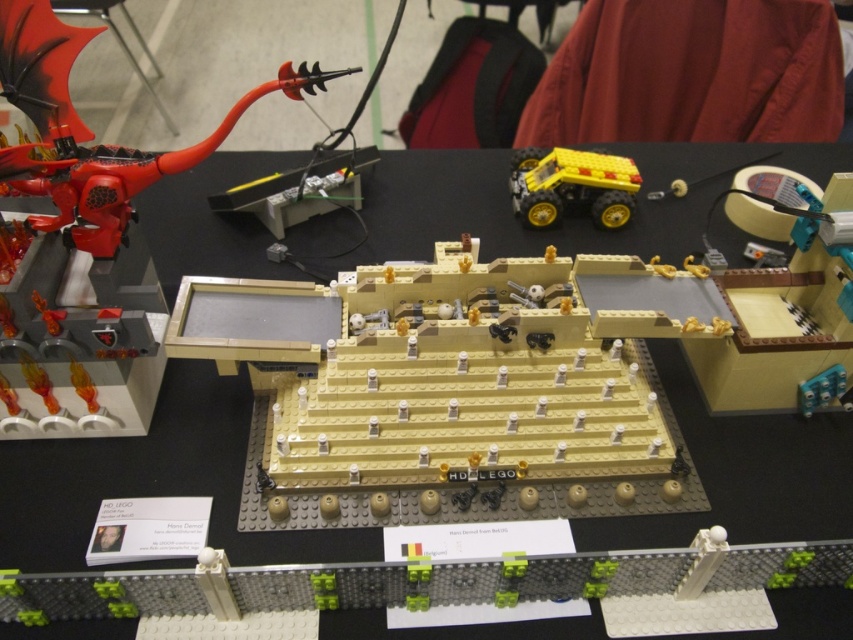
Which is in front, point (473, 582) or point (93, 148)?

Point (473, 582) is in front.

Does point (851, 579) come closer to viewer compared to point (39, 220)?

Yes, point (851, 579) is closer to viewer.

Where is `smooth gray wall at lower center`? The image size is (853, 640). smooth gray wall at lower center is located at coordinates (459, 580).

Does beige matte chessboard at center have a smaller size compared to smooth gray wall at lower center?

Actually, beige matte chessboard at center might be larger than smooth gray wall at lower center.

Is beige matte chessboard at center below smooth gray wall at lower center?

Actually, beige matte chessboard at center is above smooth gray wall at lower center.

Which is in front, point (405, 515) or point (560, 561)?

Point (560, 561) is in front.

Locate an element on the screen. beige matte chessboard at center is located at coordinates (453, 387).

Does shiny red dragon at left come behind yellow rubber truck at upper right?

No, shiny red dragon at left is in front of yellow rubber truck at upper right.

Is shiny red dragon at left shorter than yellow rubber truck at upper right?

Incorrect, shiny red dragon at left's height does not fall short of yellow rubber truck at upper right's.

What do you see at coordinates (91, 131) in the screenshot? I see `shiny red dragon at left` at bounding box center [91, 131].

This screenshot has width=853, height=640. I want to click on shiny red dragon at left, so click(x=91, y=131).